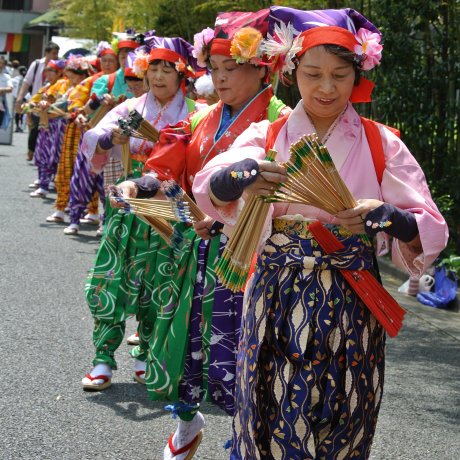
Find the location of a particular element. Image resolution: width=460 pixels, height=460 pixels. sock is located at coordinates (186, 428), (102, 369), (140, 369).